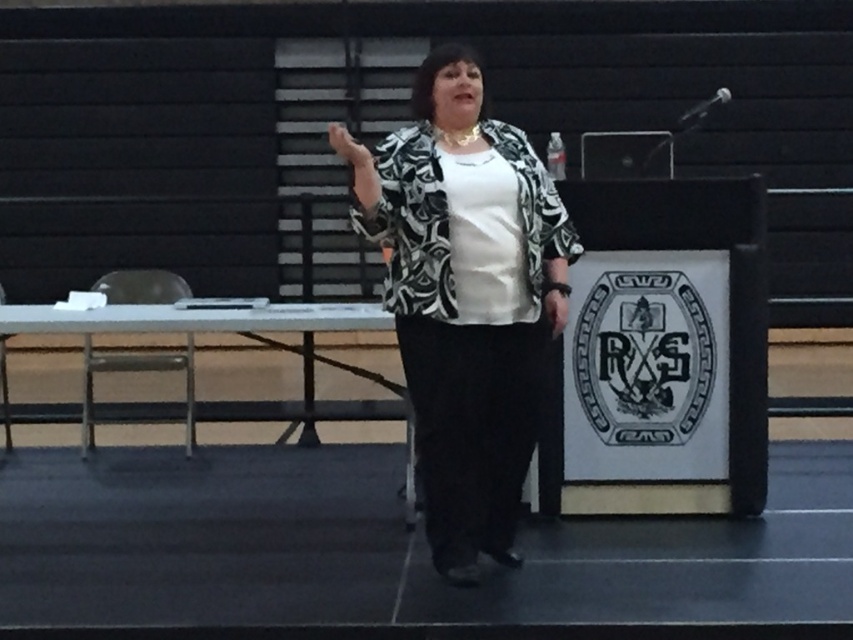
Question: Among these objects, which one is farthest from the camera?

Choices:
 (A) printed fabric jacket at center
 (B) matte black hand at upper center

Answer: (A)

Question: Which object is farther from the camera taking this photo?

Choices:
 (A) printed fabric jacket at center
 (B) matte black hand at upper center

Answer: (A)

Question: Does printed fabric jacket at center have a lesser width compared to matte black hand at upper center?

Choices:
 (A) yes
 (B) no

Answer: (B)

Question: Can you confirm if printed fabric jacket at center is positioned to the left of matte black hand at upper center?

Choices:
 (A) yes
 (B) no

Answer: (B)

Question: Is printed fabric jacket at center positioned behind matte black hand at upper center?

Choices:
 (A) no
 (B) yes

Answer: (B)